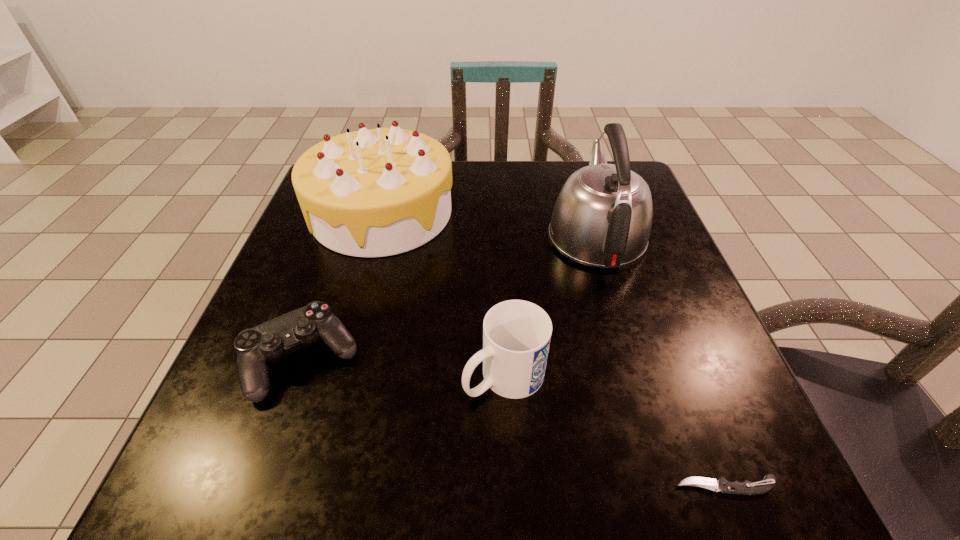
Where is `vacant space located on the right of the fourth tallest object`? vacant space located on the right of the fourth tallest object is located at coordinates (444, 360).

The height and width of the screenshot is (540, 960). In order to click on free space located 0.190m on the left of the pocketknife in this screenshot , I will do `click(530, 485)`.

The width and height of the screenshot is (960, 540). In order to click on kettle located in the far edge section of the desktop in this screenshot , I will do `click(602, 217)`.

Where is `birthday cake located in the far edge section of the desktop`? The height and width of the screenshot is (540, 960). birthday cake located in the far edge section of the desktop is located at coordinates (378, 192).

Where is `object situated at the near edge`? object situated at the near edge is located at coordinates (746, 487).

The width and height of the screenshot is (960, 540). In order to click on birthday cake present at the left edge in this screenshot , I will do `click(378, 192)`.

This screenshot has width=960, height=540. Find the location of `control situated at the left edge`. control situated at the left edge is located at coordinates (254, 346).

The height and width of the screenshot is (540, 960). Find the location of `kettle located in the right edge section of the desktop`. kettle located in the right edge section of the desktop is located at coordinates (602, 217).

The height and width of the screenshot is (540, 960). Find the location of `pocketknife that is at the right edge`. pocketknife that is at the right edge is located at coordinates (746, 487).

The width and height of the screenshot is (960, 540). In order to click on object situated at the far left corner in this screenshot , I will do `click(378, 192)`.